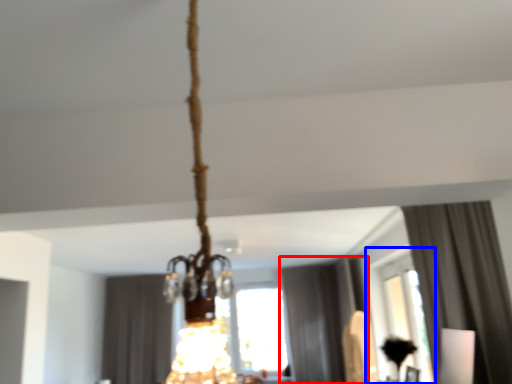
Question: Which object appears farthest to the camera in this image, curtain (highlighted by a red box) or window (highlighted by a blue box)?

Choices:
 (A) curtain
 (B) window

Answer: (A)